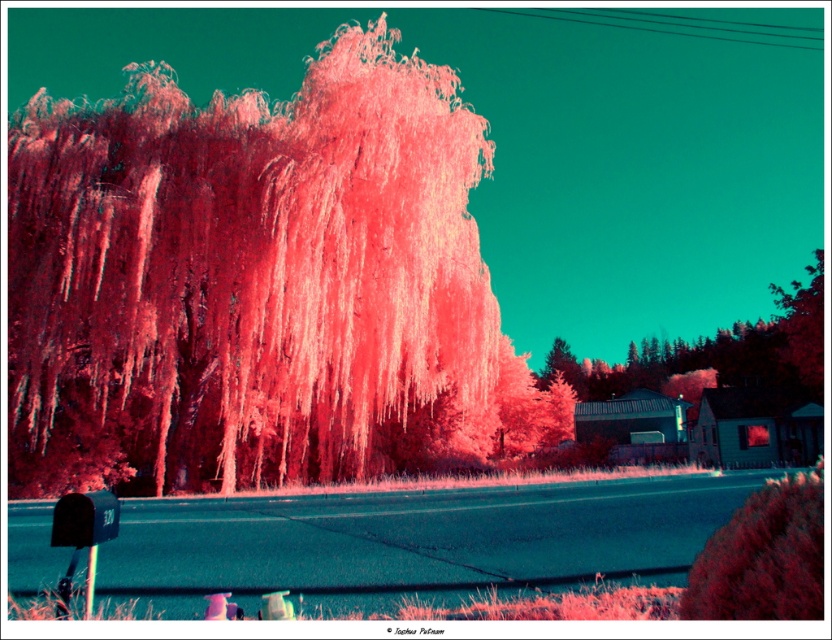
Question: Can you confirm if pink matte tree at center is wider than smooth red tree at lower right?

Choices:
 (A) yes
 (B) no

Answer: (A)

Question: Which of the following is the farthest from the observer?

Choices:
 (A) (681, 616)
 (B) (109, 280)

Answer: (B)

Question: Considering the relative positions of pink matte tree at center and smooth red tree at lower right in the image provided, where is pink matte tree at center located with respect to smooth red tree at lower right?

Choices:
 (A) above
 (B) below

Answer: (A)

Question: Which of the following is the farthest from the observer?

Choices:
 (A) smooth red tree at lower right
 (B) pink matte tree at center

Answer: (B)

Question: Is pink matte tree at center below smooth red tree at lower right?

Choices:
 (A) yes
 (B) no

Answer: (B)